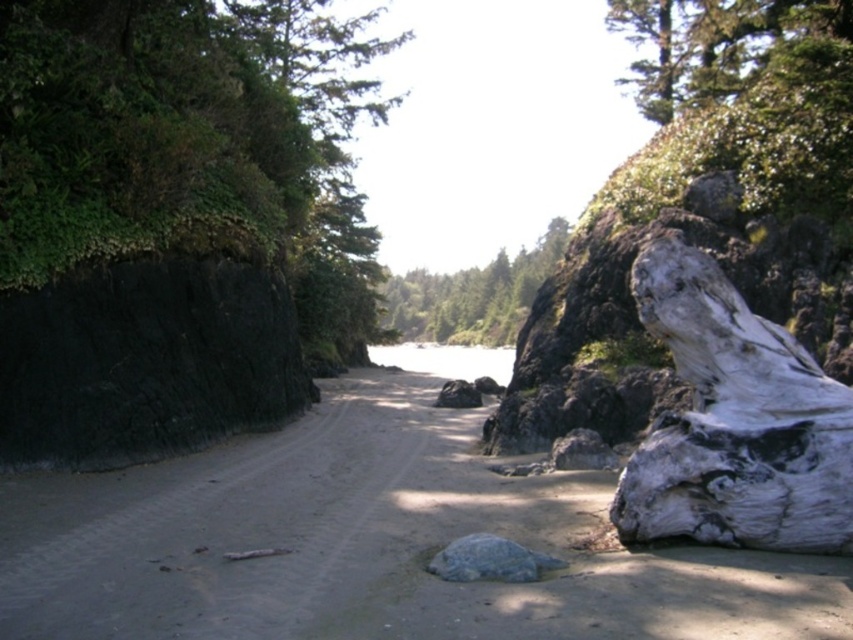
You are standing at the point marked as point (643, 106) and want to walk to the point marked as point (389, 301). Which direction should you move relative to the cliff face on the left?

You should move away from the cliff face on the left because point (389, 301) is farther from the cliff face than point (643, 106).

You are a hiker standing on the sandy path and want to reach the gray smooth rock at center. Which direction should you move to avoid the white weathered wood stump at right?

To reach the gray smooth rock at center while avoiding the white weathered wood stump at right, move to the left side of the gray smooth rock at center since the stump is on its right.